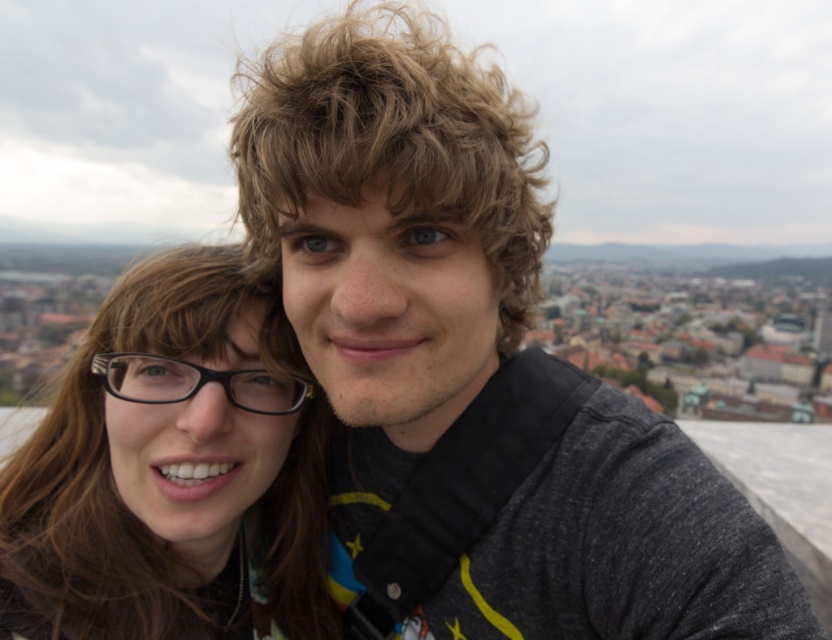
You are taking a selfie with two friends in a city setting. You notice two points in the background at coordinates point (699, 550) and point (184, 563). Which point is nearer to your camera lens?

Point (699, 550) is closer to the camera than point (184, 563).

You are a drone operator trying to capture a closeup shot of the gray fabric jacket at center and the matte black glasses at left. The drone has a maximum focus range of 15 meters. Can the drone capture both objects in focus at the same time?

The distance between the gray fabric jacket at center and the matte black glasses at left is 16.60 meters. Since the drone can only focus within 15 meters, it cannot capture both objects in focus simultaneously.